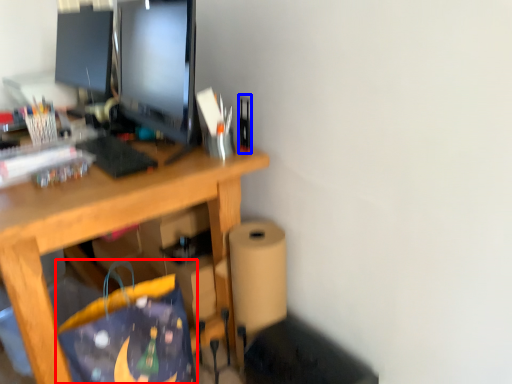
Question: Which object is further to the camera taking this photo, shopping bag (highlighted by a red box) or stationery (highlighted by a blue box)?

Choices:
 (A) shopping bag
 (B) stationery

Answer: (B)